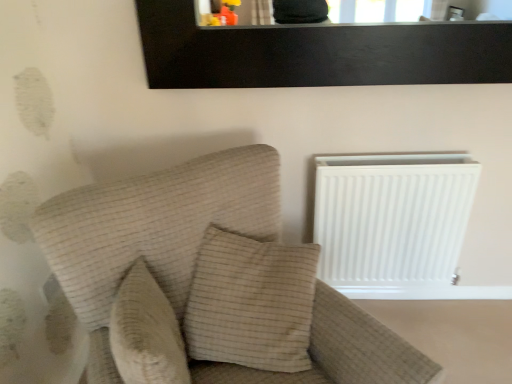
Question: Should I look upward or downward to see beige textured pillow at center, positioned as the second pillow in right-to-left order?

Choices:
 (A) up
 (B) down

Answer: (B)

Question: Does black wood picture frame at upper center appear on the right side of beige textured pillow at center, which is counted as the second pillow, starting from the left?

Choices:
 (A) yes
 (B) no

Answer: (A)

Question: Considering the relative sizes of black wood picture frame at upper center and beige textured pillow at center, which is the first pillow in right-to-left order, in the image provided, is black wood picture frame at upper center shorter than beige textured pillow at center, which is the first pillow in right-to-left order,?

Choices:
 (A) no
 (B) yes

Answer: (A)

Question: Is black wood picture frame at upper center aimed at beige textured pillow at center, which is the first pillow in right-to-left order?

Choices:
 (A) yes
 (B) no

Answer: (B)

Question: Does black wood picture frame at upper center have a greater height compared to beige textured pillow at center, which is counted as the second pillow, starting from the left?

Choices:
 (A) yes
 (B) no

Answer: (A)

Question: Is black wood picture frame at upper center further to camera compared to beige textured pillow at center, which is the first pillow in right-to-left order?

Choices:
 (A) no
 (B) yes

Answer: (B)

Question: From the image's perspective, is black wood picture frame at upper center beneath beige textured pillow at center, which is counted as the second pillow, starting from the left?

Choices:
 (A) no
 (B) yes

Answer: (A)

Question: Considering the relative sizes of beige fabric couch at left and beige textured pillow at center, positioned as the second pillow in right-to-left order, in the image provided, is beige fabric couch at left smaller than beige textured pillow at center, positioned as the second pillow in right-to-left order,?

Choices:
 (A) yes
 (B) no

Answer: (B)

Question: From a real-world perspective, is beige fabric couch at left positioned under beige textured pillow at center, positioned as the second pillow in right-to-left order, based on gravity?

Choices:
 (A) yes
 (B) no

Answer: (A)

Question: Is beige fabric couch at left located outside beige textured pillow at center, positioned as the 1th pillow in left-to-right order?

Choices:
 (A) no
 (B) yes

Answer: (B)

Question: Is beige fabric couch at left surrounding beige textured pillow at center, positioned as the second pillow in right-to-left order?

Choices:
 (A) no
 (B) yes

Answer: (B)

Question: From a real-world perspective, is beige fabric couch at left on beige textured pillow at center, positioned as the second pillow in right-to-left order?

Choices:
 (A) yes
 (B) no

Answer: (B)

Question: Is beige fabric couch at left shorter than beige textured pillow at center, positioned as the 1th pillow in left-to-right order?

Choices:
 (A) yes
 (B) no

Answer: (B)

Question: Is beige textured pillow at center, positioned as the 1th pillow in left-to-right order, with beige fabric couch at left?

Choices:
 (A) yes
 (B) no

Answer: (B)